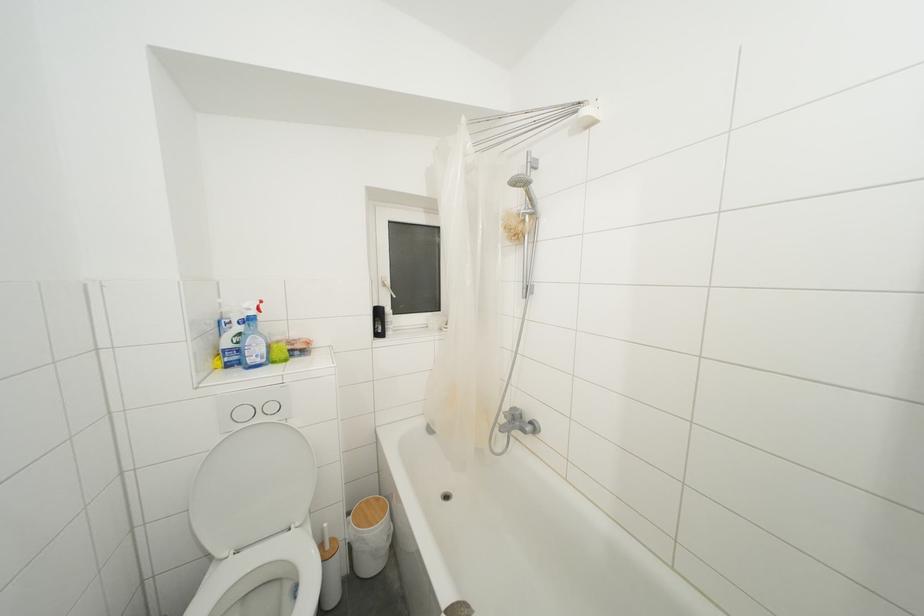
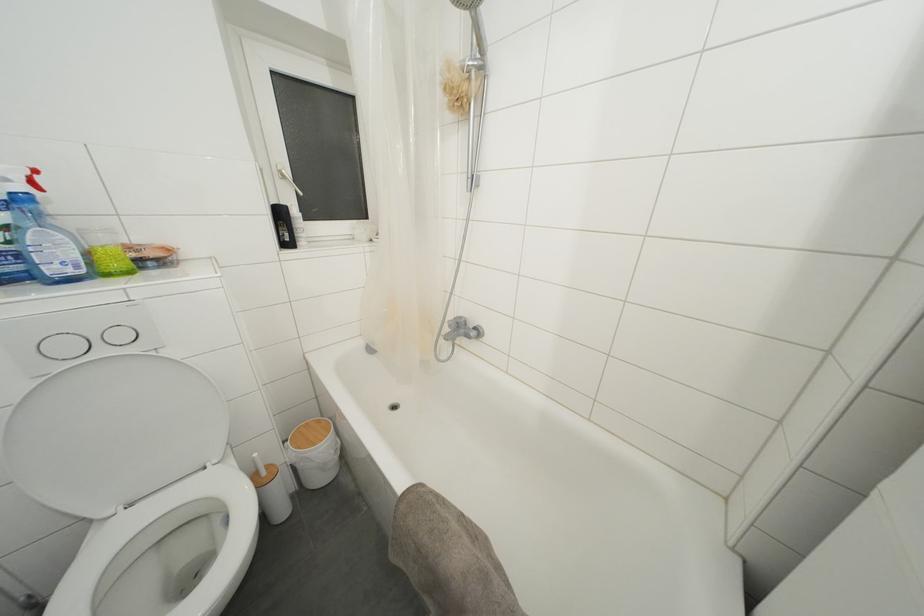
In the second image, find the point that corresponds to pixel 249 418 in the first image.

(71, 352)